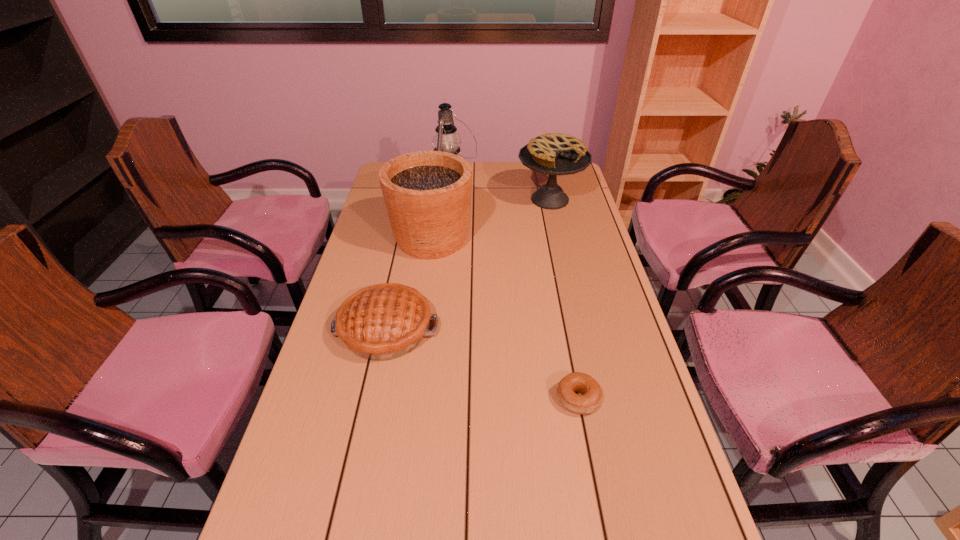
Locate an element on the screen. the tallest object is located at coordinates (446, 140).

Where is `flowerpot`? flowerpot is located at coordinates (427, 194).

Locate an element on the screen. The image size is (960, 540). the right pie is located at coordinates (554, 154).

Locate an element on the screen. The height and width of the screenshot is (540, 960). the taller pie is located at coordinates (554, 154).

You are a GUI agent. You are given a task and a screenshot of the screen. Output one action in this format:
    pyautogui.click(x=<x>, y=<y>)
    Task: Click on the left pie
    The height and width of the screenshot is (540, 960).
    Given the screenshot: What is the action you would take?
    pyautogui.click(x=382, y=322)

You are a GUI agent. You are given a task and a screenshot of the screen. Output one action in this format:
    pyautogui.click(x=<x>, y=<y>)
    Task: Click on the shorter pie
    The width and height of the screenshot is (960, 540).
    Given the screenshot: What is the action you would take?
    pyautogui.click(x=382, y=322)

What are the coordinates of `the nearest object` in the screenshot? It's located at (589, 400).

You are a GUI agent. You are given a task and a screenshot of the screen. Output one action in this format:
    pyautogui.click(x=<x>, y=<y>)
    Task: Click on the bagel
    Image resolution: width=960 pixels, height=540 pixels.
    Given the screenshot: What is the action you would take?
    pyautogui.click(x=589, y=400)

Where is `free space located 0.150m on the front of the oil lamp`? free space located 0.150m on the front of the oil lamp is located at coordinates (449, 206).

The height and width of the screenshot is (540, 960). Find the location of `free space located 0.120m on the right of the flowerpot`. free space located 0.120m on the right of the flowerpot is located at coordinates (508, 239).